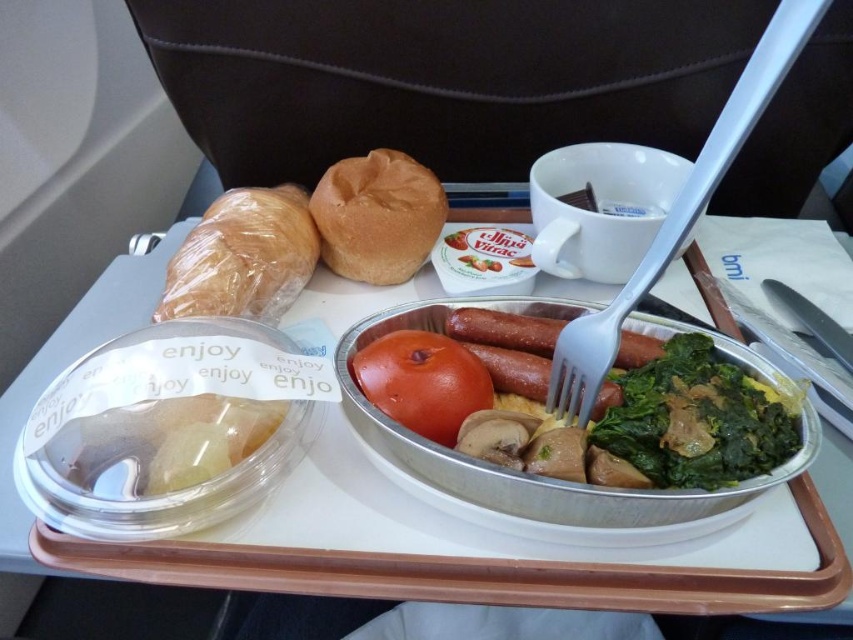
Question: Estimate the real-world distances between objects in this image. Which object is closer to the green leafy vegetable at center?

Choices:
 (A) baked golden-brown bread at center
 (B) red matte tomato at center
 (C) translucent plastic bread at upper left

Answer: (B)

Question: Does green leafy vegetable at center come behind translucent plastic bread at upper left?

Choices:
 (A) no
 (B) yes

Answer: (A)

Question: Which of these objects is positioned farthest from the red matte tomato at center?

Choices:
 (A) green leafy vegetable at center
 (B) baked golden-brown bread at center
 (C) translucent plastic bread at upper left

Answer: (C)

Question: Considering the relative positions of baked golden-brown bread at center and red matte tomato at center in the image provided, where is baked golden-brown bread at center located with respect to red matte tomato at center?

Choices:
 (A) above
 (B) below

Answer: (A)

Question: Is green leafy vegetable at center wider than translucent plastic bread at upper left?

Choices:
 (A) no
 (B) yes

Answer: (B)

Question: Which point is closer to the camera?

Choices:
 (A) red matte tomato at center
 (B) green leafy vegetable at center

Answer: (B)